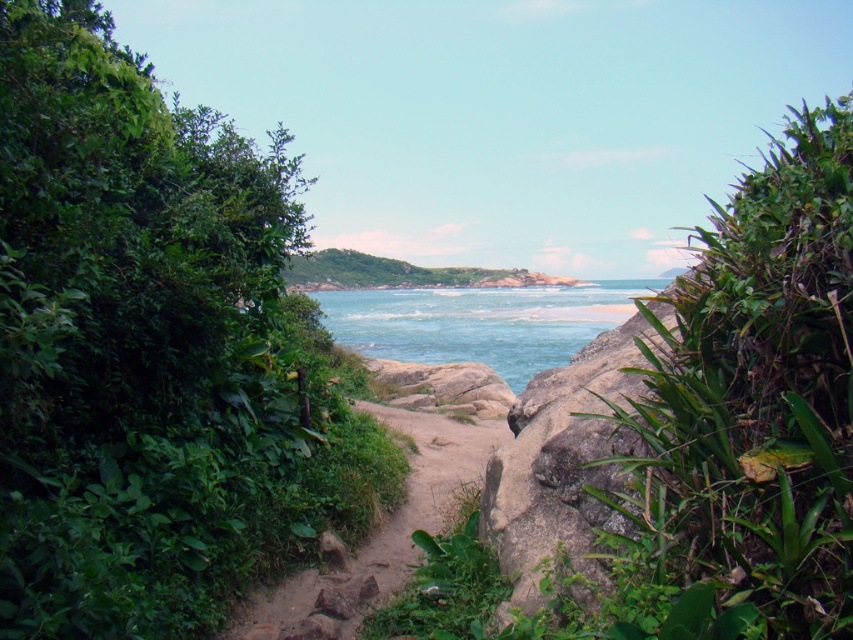
You are a hiker who wants to take a photo of the dirt path at center. You notice the green leafy plant at right might block your view. Is the plant taller than the path?

The green leafy plant at right is taller than the dirt path at center, so it might block your view when taking the photo.